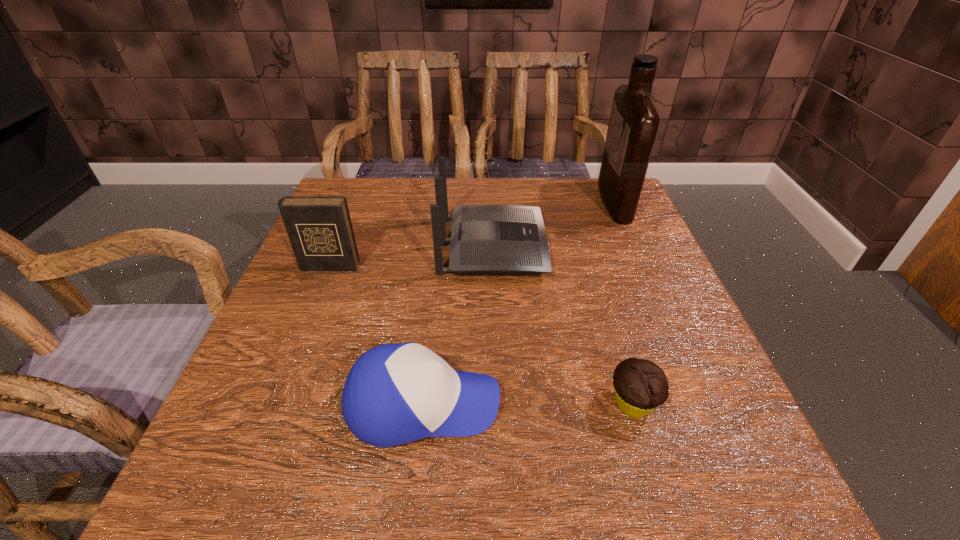
Find the location of a particular element. This screenshot has width=960, height=540. vacant space located on the front-facing side of the router is located at coordinates (589, 247).

Locate an element on the screen. The width and height of the screenshot is (960, 540). vacant region located 0.180m on the front cover of the diary is located at coordinates (300, 336).

At what (x,y) coordinates should I click in order to perform the action: click on vacant region located 0.150m on the front-facing side of the baseball cap. Please return your answer as a coordinate pair (x, y). Image resolution: width=960 pixels, height=540 pixels. Looking at the image, I should click on (597, 404).

Image resolution: width=960 pixels, height=540 pixels. Find the location of `vacant area located 0.340m on the left of the fourth object from left to right`. vacant area located 0.340m on the left of the fourth object from left to right is located at coordinates (387, 403).

You are a GUI agent. You are given a task and a screenshot of the screen. Output one action in this format:
    pyautogui.click(x=<x>, y=<y>)
    Task: Click on the liquor that is at the far edge
    
    Given the screenshot: What is the action you would take?
    pyautogui.click(x=633, y=125)

What are the coordinates of `router that is at the far edge` in the screenshot? It's located at (485, 239).

Locate an element on the screen. This screenshot has height=540, width=960. object situated at the near edge is located at coordinates (394, 394).

What are the coordinates of `object that is at the left edge` in the screenshot? It's located at (319, 228).

The image size is (960, 540). Identify the location of liquor present at the right edge. (633, 125).

Where is `muffin situated at the right edge`? This screenshot has width=960, height=540. muffin situated at the right edge is located at coordinates (640, 386).